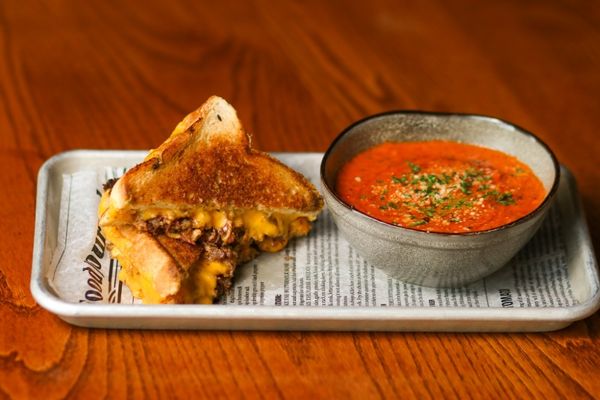
Find the location of a particular element. Image resolution: width=600 pixels, height=400 pixels. shadow of tray is located at coordinates (578, 330).